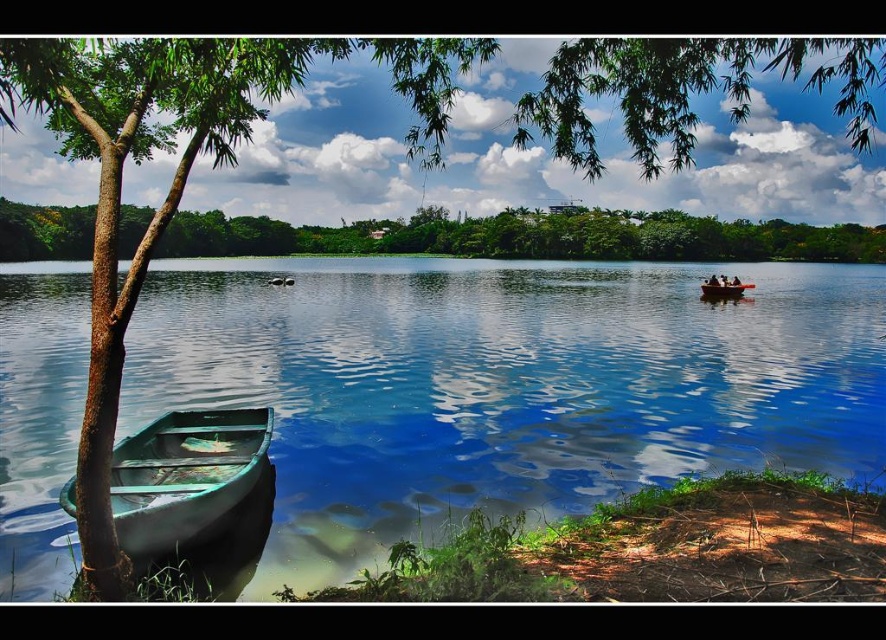
Is green leafy tree at upper center wider than wooden boat at center?

Correct, the width of green leafy tree at upper center exceeds that of wooden boat at center.

Does green leafy tree at upper center appear on the left side of wooden boat at center?

No, green leafy tree at upper center is not to the left of wooden boat at center.

Find the location of a particular element. Image resolution: width=886 pixels, height=640 pixels. green leafy tree at upper center is located at coordinates (532, 237).

Is green matte boat at lower left smaller than green wooden boat at lower left?

Incorrect, green matte boat at lower left is not smaller in size than green wooden boat at lower left.

Describe the element at coordinates (504, 385) in the screenshot. I see `green matte boat at lower left` at that location.

Is point (372, 442) closer to viewer compared to point (211, 512)?

No, it is not.

You are a GUI agent. You are given a task and a screenshot of the screen. Output one action in this format:
    pyautogui.click(x=<x>, y=<y>)
    Task: Click on the green matte boat at lower left
    
    Given the screenshot: What is the action you would take?
    pyautogui.click(x=504, y=385)

Does green leafy tree at upper center have a larger size compared to green wooden boat at lower left?

Yes, green leafy tree at upper center is bigger than green wooden boat at lower left.

Which is in front, point (661, 212) or point (171, 444)?

Point (171, 444)

Between point (739, 244) and point (242, 438), which one is positioned in front?

Point (242, 438) is in front.

Where is `green leafy tree at upper center`? green leafy tree at upper center is located at coordinates (532, 237).